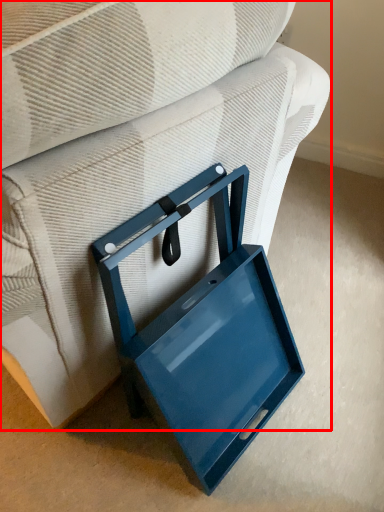
Question: From the image, what is the correct spatial relationship of furniture (annotated by the red box) in relation to lunch box?

Choices:
 (A) right
 (B) left

Answer: (B)